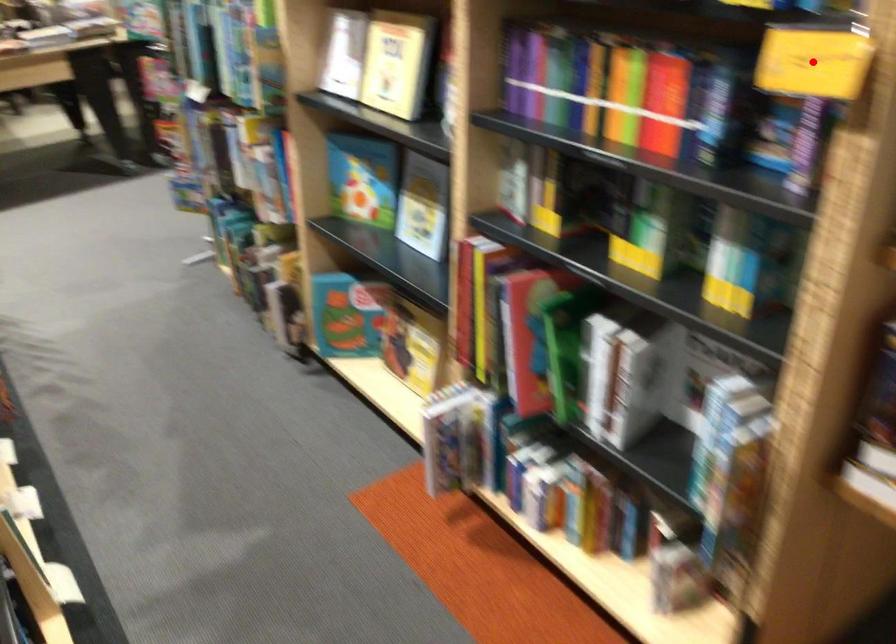
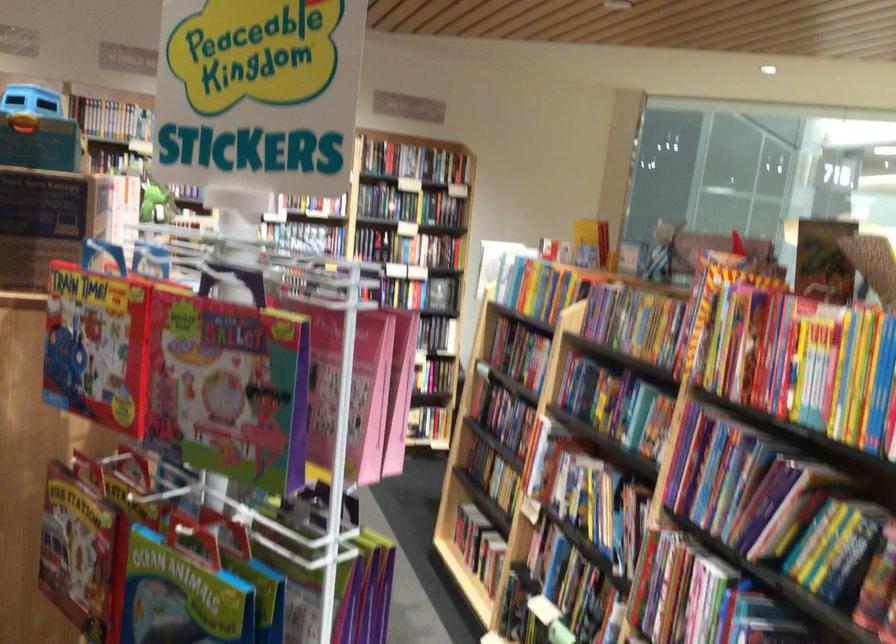
Question: I am providing you with two images of the same scene from different viewpoints. A red point is marked on the first image. At the location where the point appears in image 1, is it still visible in image 2?

Choices:
 (A) Yes
 (B) No

Answer: (B)